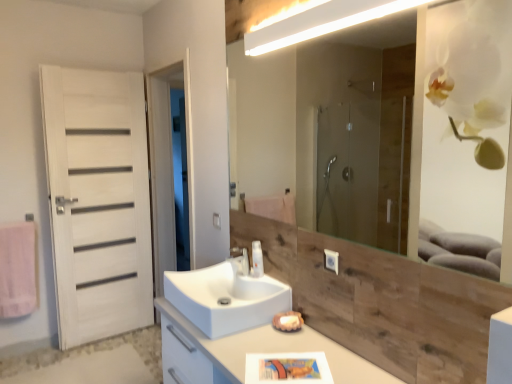
Question: From a real-world perspective, is white glossy light fixture at upper center below white matte door at left?

Choices:
 (A) yes
 (B) no

Answer: (B)

Question: Is the position of white glossy light fixture at upper center less distant than that of white matte door at left?

Choices:
 (A) yes
 (B) no

Answer: (A)

Question: Can white matte door at left be found inside white glossy light fixture at upper center?

Choices:
 (A) no
 (B) yes

Answer: (A)

Question: Is white glossy light fixture at upper center taller than white matte door at left?

Choices:
 (A) yes
 (B) no

Answer: (B)

Question: Would you consider white glossy light fixture at upper center to be distant from white matte door at left?

Choices:
 (A) no
 (B) yes

Answer: (B)

Question: From their relative heights in the image, would you say white glossy cabinet at center is taller or shorter than white glossy sink at center?

Choices:
 (A) tall
 (B) short

Answer: (A)

Question: From the image's perspective, is white glossy cabinet at center located above or below white glossy sink at center?

Choices:
 (A) above
 (B) below

Answer: (B)

Question: From a real-world perspective, is white glossy cabinet at center above or below white glossy sink at center?

Choices:
 (A) above
 (B) below

Answer: (B)

Question: Is white glossy cabinet at center bigger or smaller than white glossy sink at center?

Choices:
 (A) big
 (B) small

Answer: (A)

Question: Considering the positions of white glossy sink at center and wooden/matte mirror at upper center in the image, is white glossy sink at center taller or shorter than wooden/matte mirror at upper center?

Choices:
 (A) short
 (B) tall

Answer: (A)

Question: Is white glossy sink at center in front of or behind wooden/matte mirror at upper center in the image?

Choices:
 (A) behind
 (B) front

Answer: (A)

Question: Is point (261, 296) closer or farther from the camera than point (373, 144)?

Choices:
 (A) closer
 (B) farther

Answer: (A)

Question: From the image's perspective, relative to wooden/matte mirror at upper center, is white glossy sink at center above or below?

Choices:
 (A) above
 (B) below

Answer: (B)

Question: In terms of width, does white wood door at left look wider or thinner when compared to pink fabric towel at left?

Choices:
 (A) wide
 (B) thin

Answer: (A)

Question: From their relative heights in the image, would you say white wood door at left is taller or shorter than pink fabric towel at left?

Choices:
 (A) short
 (B) tall

Answer: (B)